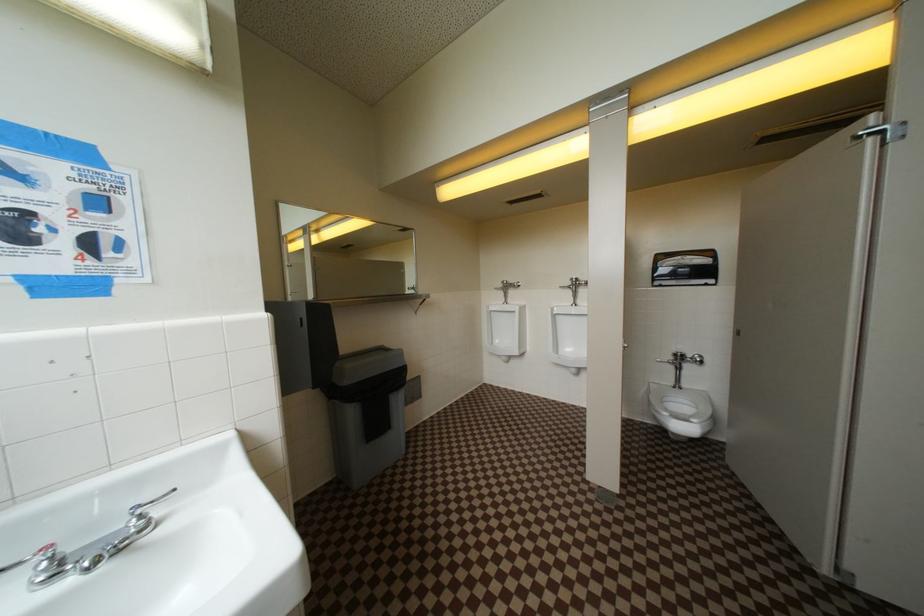
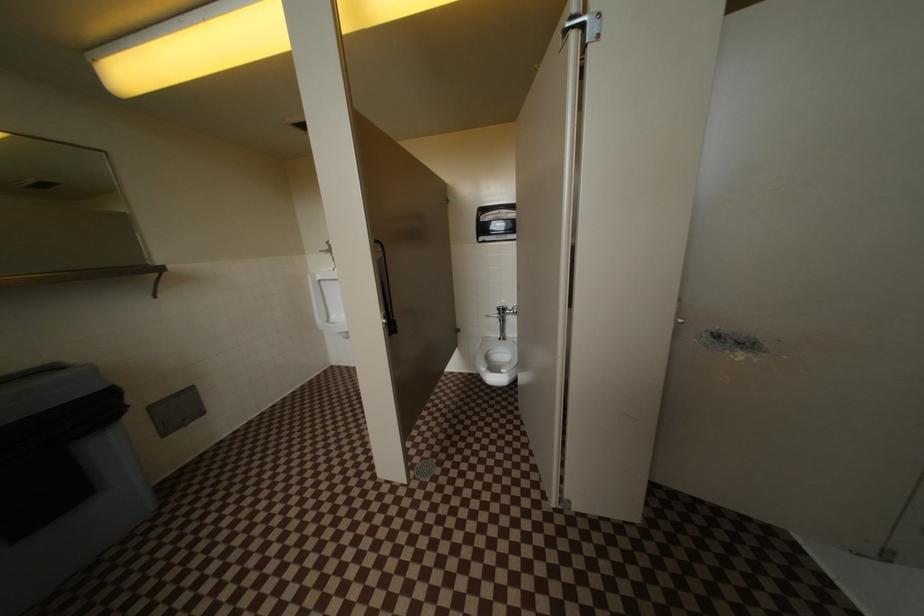
Question: The first image is from the beginning of the video and the second image is from the end. How did the camera likely rotate when shooting the video?

Choices:
 (A) Left
 (B) Right
 (C) Up
 (D) Down

Answer: (B)